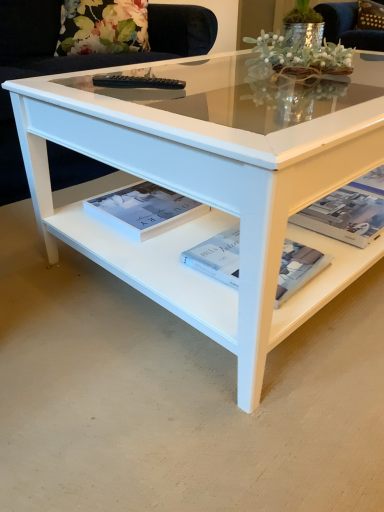
Question: From the image's perspective, is brown fabric pillow at upper right above or below white paper magazine at center, acting as the second magazine starting from the right?

Choices:
 (A) below
 (B) above

Answer: (B)

Question: From their relative heights in the image, would you say brown fabric pillow at upper right is taller or shorter than white paper magazine at center, acting as the second magazine starting from the right?

Choices:
 (A) tall
 (B) short

Answer: (A)

Question: Which object is positioned closest to the white paper magazine at center, which appears as the 2th magazine when viewed from the left?

Choices:
 (A) white glossy book at center, placed as the third magazine when sorted from right to left
 (B) white glossy coffee table at center
 (C) white glossy magazine at lower right, which ranks as the 3th magazine in left-to-right order
 (D) brown fabric pillow at upper right

Answer: (B)

Question: Which of these objects is positioned closest to the white glossy book at center, placed as the third magazine when sorted from right to left?

Choices:
 (A) brown fabric pillow at upper right
 (B) white paper magazine at center, acting as the second magazine starting from the right
 (C) white glossy coffee table at center
 (D) white glossy magazine at lower right, which ranks as the 3th magazine in left-to-right order

Answer: (C)